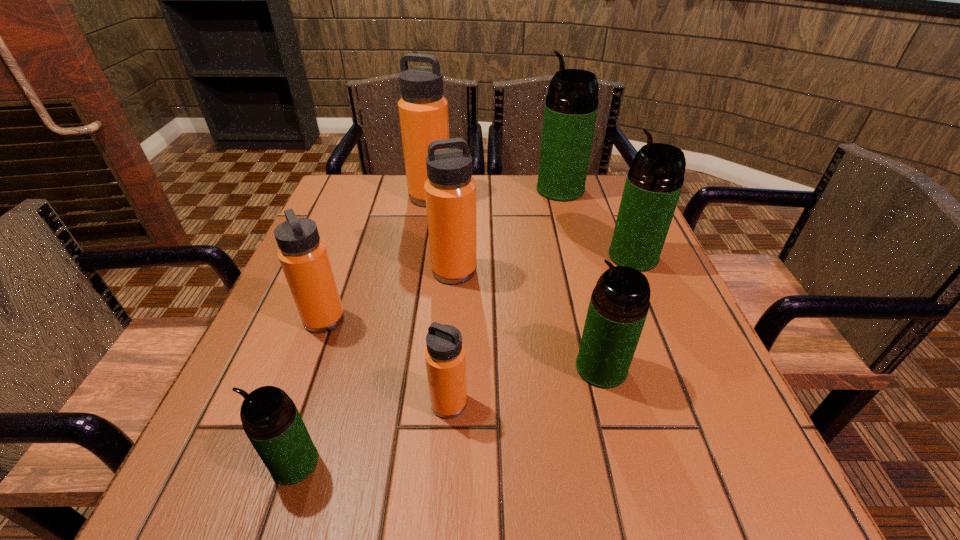
Where is `the nearest orange thermos bottle`? This screenshot has width=960, height=540. the nearest orange thermos bottle is located at coordinates (445, 357).

Locate an element on the screen. vacant area situated 0.140m on the right of the biggest orange thermos bottle is located at coordinates (503, 197).

Image resolution: width=960 pixels, height=540 pixels. Identify the location of vacant space located 0.160m from the spout of the biggest green thermos bottle. (479, 190).

The width and height of the screenshot is (960, 540). In order to click on free space located 0.300m from the spout of the biggest green thermos bottle in this screenshot , I will do `click(429, 190)`.

Where is `free space located from the spout of the biggest green thermos bottle`? The width and height of the screenshot is (960, 540). free space located from the spout of the biggest green thermos bottle is located at coordinates (479, 190).

The width and height of the screenshot is (960, 540). What are the coordinates of `free space located from the spout of the third smallest green thermos bottle` in the screenshot? It's located at (433, 256).

The height and width of the screenshot is (540, 960). I want to click on vacant point located from the spout of the third smallest green thermos bottle, so click(x=547, y=256).

Locate an element on the screen. The height and width of the screenshot is (540, 960). blank area located from the spout of the third smallest green thermos bottle is located at coordinates [508, 256].

This screenshot has width=960, height=540. Identify the location of free space located 0.280m on the front of the second biggest orange thermos bottle. (445, 401).

Where is `free region located on the back of the fifth farthest thermos bottle`? The width and height of the screenshot is (960, 540). free region located on the back of the fifth farthest thermos bottle is located at coordinates (339, 279).